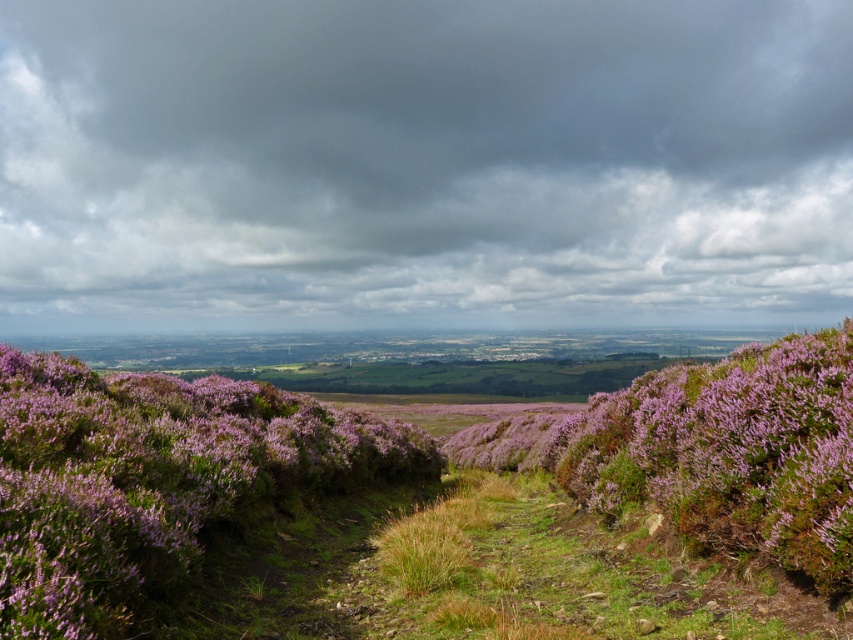
Between dark gray cloud at upper center and purple leafy bush at center, which one has less height?

purple leafy bush at center

Is dark gray cloud at upper center taller than purple leafy bush at center?

Yes.

Who is more forward, (163, 196) or (714, 440)?

Point (714, 440) is in front.

At what (x,y) coordinates should I click in order to perform the action: click on dark gray cloud at upper center. Please return your answer as a coordinate pair (x, y). This screenshot has width=853, height=640. Looking at the image, I should click on (422, 164).

Is dark gray cloud at upper center in front of green grassy at center?

That is False.

Which is in front, point (757, 294) or point (531, 616)?

Point (531, 616) is in front.

Which is in front, point (753, 300) or point (611, 616)?

Positioned in front is point (611, 616).

Find the location of a particular element. The width and height of the screenshot is (853, 640). dark gray cloud at upper center is located at coordinates (422, 164).

From the picture: Between purple leafy bush at center and green grassy at center, which one has less height?

Standing shorter between the two is green grassy at center.

Does purple leafy bush at center have a greater height compared to green grassy at center?

Yes, purple leafy bush at center is taller than green grassy at center.

Is point (670, 451) positioned after point (578, 577)?

Yes, it is.

This screenshot has height=640, width=853. Identify the location of purple leafy bush at center. (728, 451).